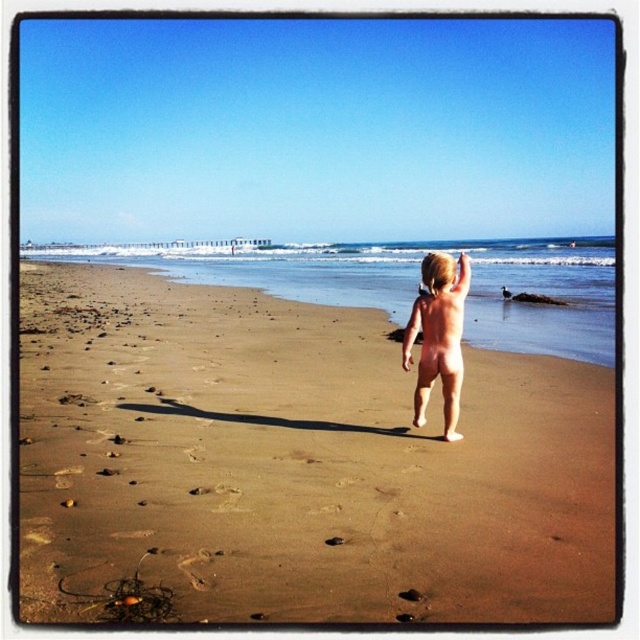
Question: From the image, what is the correct spatial relationship of brown sandy beach at center in relation to nude skin at center?

Choices:
 (A) above
 (B) below

Answer: (B)

Question: Which point is closer to the camera?

Choices:
 (A) nude skin at center
 (B) brown sandy beach at center

Answer: (B)

Question: Which point is farther from the camera taking this photo?

Choices:
 (A) (419, 307)
 (B) (369, 541)

Answer: (A)

Question: In this image, where is brown sandy beach at center located relative to nude skin at center?

Choices:
 (A) below
 (B) above

Answer: (A)

Question: Can you confirm if brown sandy beach at center is thinner than nude skin at center?

Choices:
 (A) yes
 (B) no

Answer: (B)

Question: Which object is farther from the camera taking this photo?

Choices:
 (A) nude skin at center
 (B) brown sandy beach at center

Answer: (A)